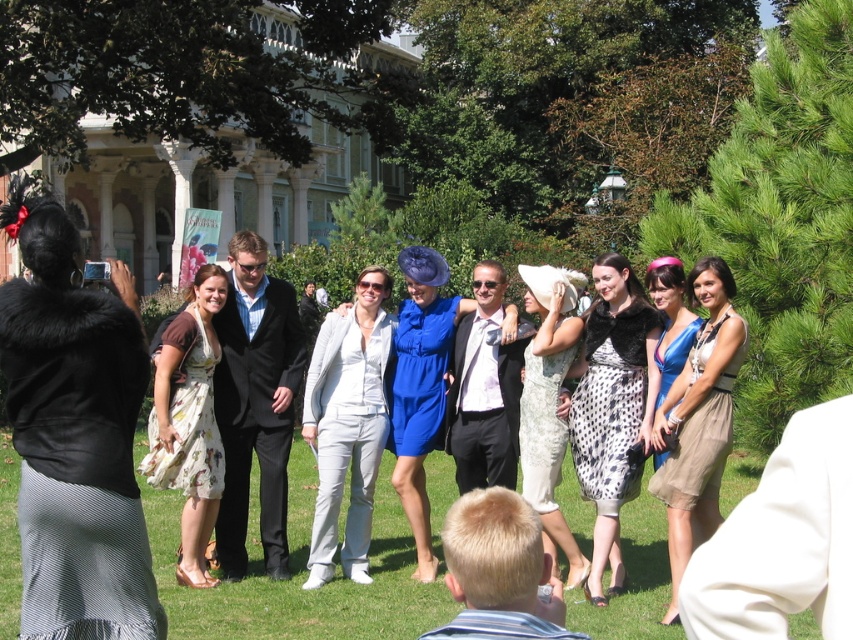
You are a photographer at this event and need to arrange the two dresses, the dotted fabric dress at center and the floral print dress at center, side by side in a photo. Which dress should be placed on the left to ensure they both fit within the frame without overlapping?

The dotted fabric dress at center is wider than the floral print dress at center, so placing the floral print dress at center on the left and the dotted fabric dress at center on the right would allow both to fit without overlapping.

You are a photographer at the event and need to capture a clear photo of the dotted fabric dress at center. However, the floral print dress at center is blocking the view. Based on their positions, can you adjust your angle to take the photo without obstruction?

The dotted fabric dress at center is in front of the floral print dress at center, so you can take the photo without needing to adjust your angle as it is already visible.

You are a photographer at this event and want to capture a photo of the floral print dress at center and the green grass at center. Based on their positions, which object is located to the left of the other?

The floral print dress at center is located to the left of the green grass at center because the green grass at center is positioned on the right side of the floral print dress at center.